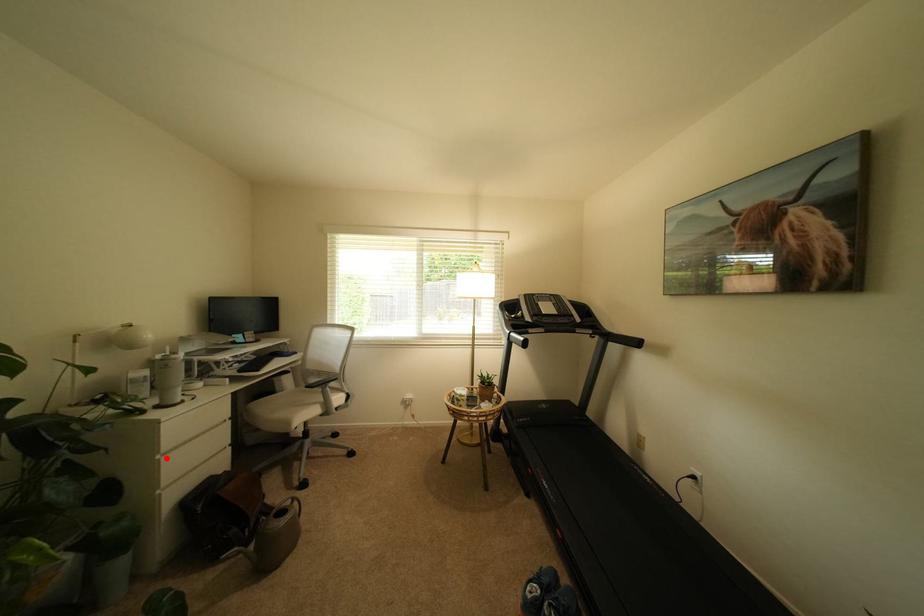
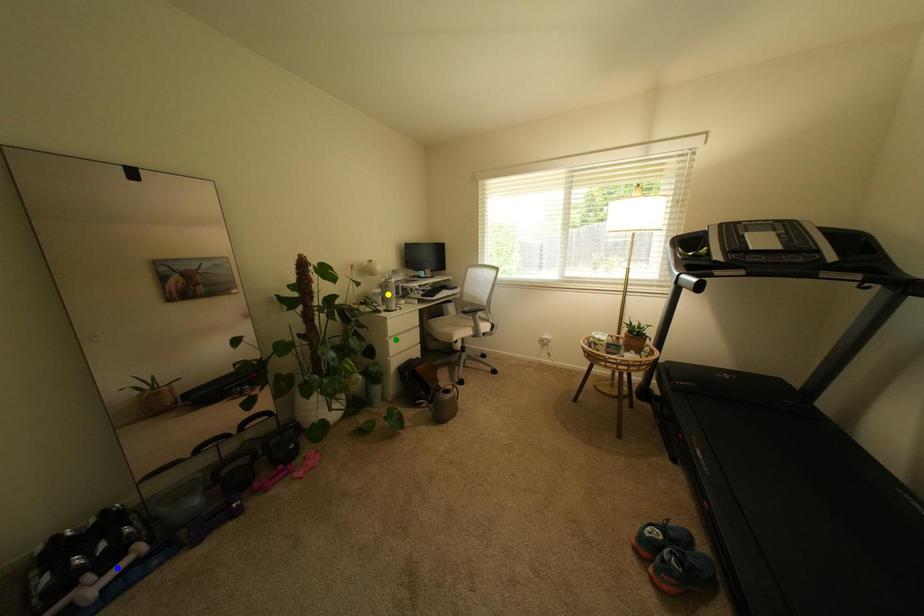
Question: I am providing you with two images of the same scene from different viewpoints. A red point is marked on the first image. You are given multiple points on the second image. Can you choose the point in image 2 that corresponds to the point in image 1?

Choices:
 (A) green point
 (B) blue point
 (C) yellow point

Answer: (A)